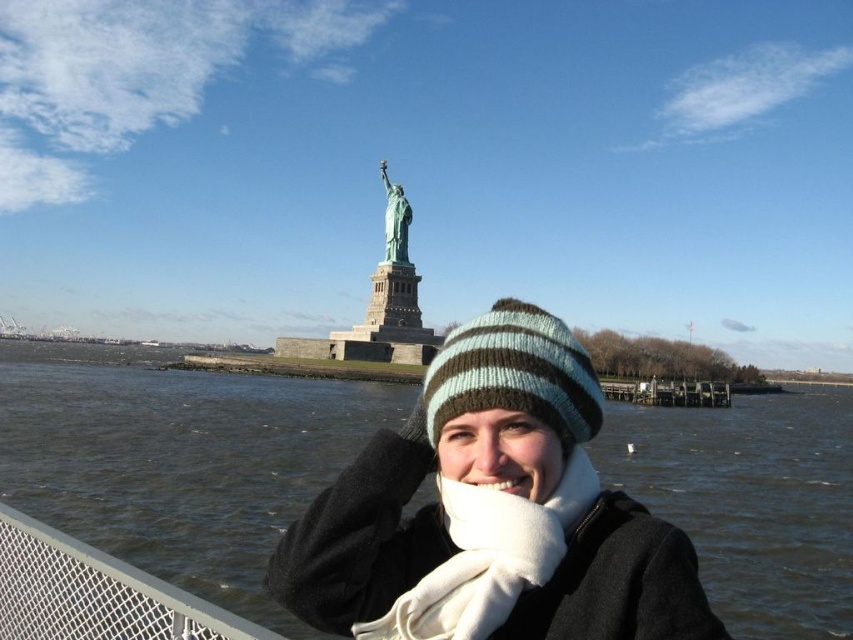
Question: Observing the image, what is the correct spatial positioning of dark gray water at lower left in reference to smooth skin nose at center?

Choices:
 (A) left
 (B) right

Answer: (A)

Question: Which of the following is the farthest from the observer?

Choices:
 (A) striped knit beanie at center
 (B) smooth skin nose at center
 (C) dark gray water at lower left

Answer: (C)

Question: Does dark gray water at lower left appear over striped knit beanie at center?

Choices:
 (A) yes
 (B) no

Answer: (B)

Question: Which point appears closest to the camera in this image?

Choices:
 (A) (395, 259)
 (B) (492, 436)

Answer: (B)

Question: Based on their relative distances, which object is nearer to the green patina statue at center?

Choices:
 (A) dark gray water at lower left
 (B) striped knit beanie at center

Answer: (A)

Question: Can you confirm if dark gray water at lower left is smaller than smooth skin nose at center?

Choices:
 (A) no
 (B) yes

Answer: (A)